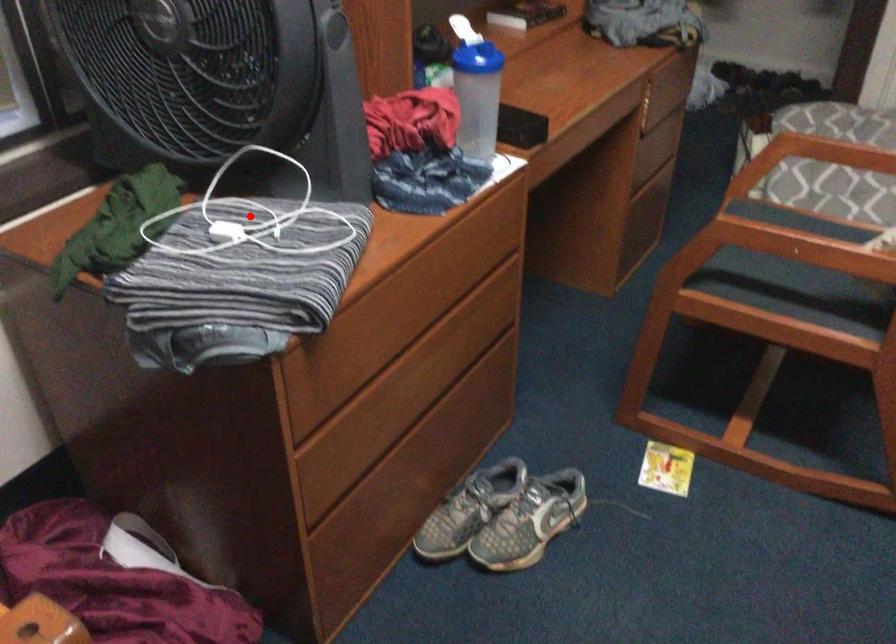
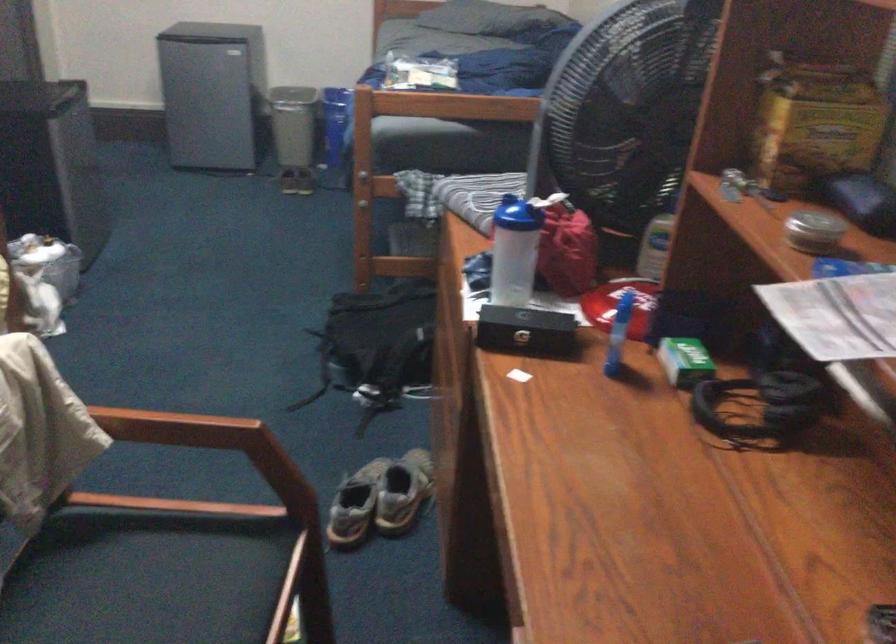
Question: I am providing you with two images of the same scene from different viewpoints. A red point is marked on the first image. At the location where the point appears in image 1, is it still visible in image 2?

Choices:
 (A) Yes
 (B) No

Answer: (B)